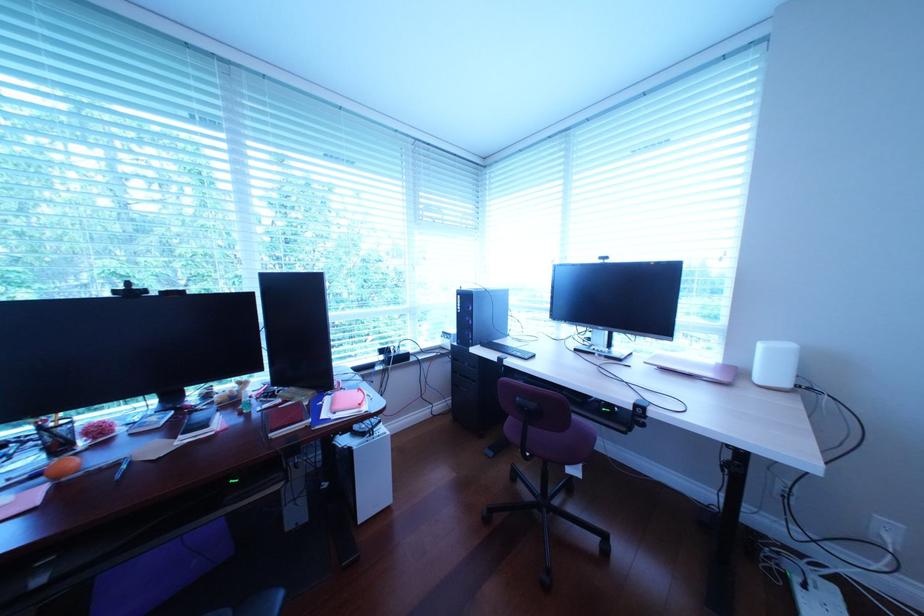
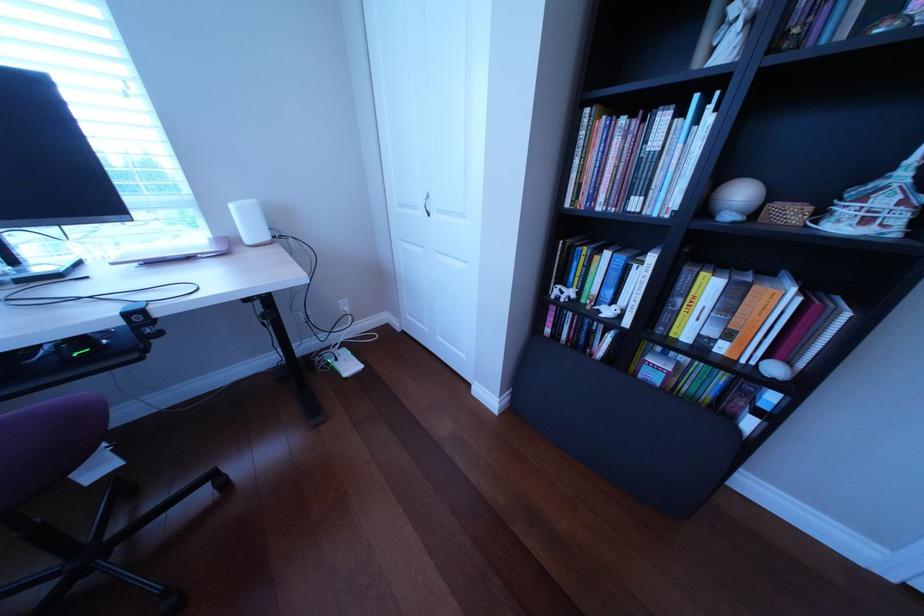
Based on the continuous images, in which direction is the camera rotating?

The camera's rotation is toward right-down.